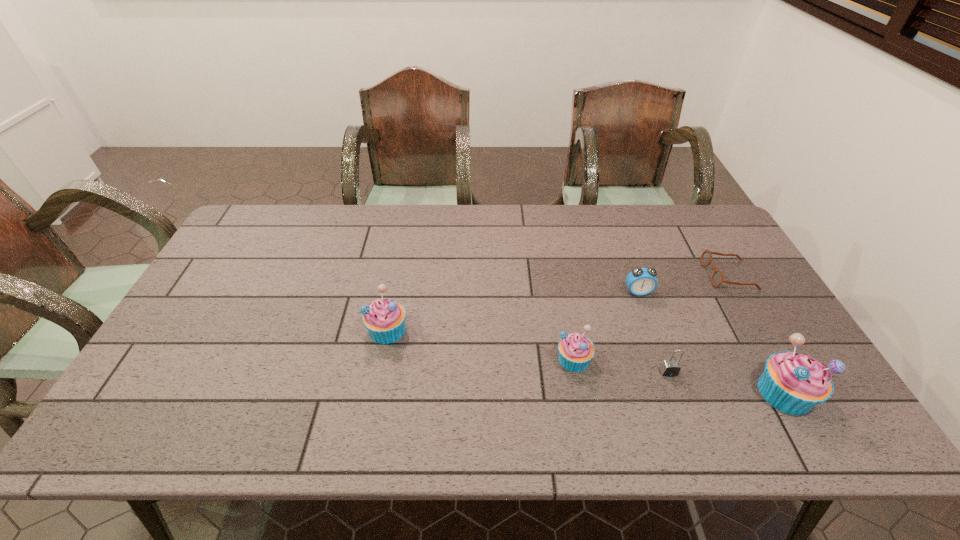
Image resolution: width=960 pixels, height=540 pixels. In order to click on vacant space located 0.080m on the back of the second muffin from right to left in this screenshot , I will do `click(566, 321)`.

Locate an element on the screen. The width and height of the screenshot is (960, 540). free space located on the back of the tallest object is located at coordinates (711, 262).

Locate an element on the screen. This screenshot has width=960, height=540. free spot located on the face of the alarm clock is located at coordinates (669, 379).

At what (x,y) coordinates should I click in order to perform the action: click on vacant space situated on the front-facing side of the spectacles. Please return your answer as a coordinate pair (x, y). This screenshot has width=960, height=540. Looking at the image, I should click on (635, 274).

You are a GUI agent. You are given a task and a screenshot of the screen. Output one action in this format:
    pyautogui.click(x=<x>, y=<y>)
    Task: Click on the blank space located on the front-facing side of the spectacles
    Image resolution: width=960 pixels, height=540 pixels.
    Given the screenshot: What is the action you would take?
    pyautogui.click(x=637, y=274)

This screenshot has width=960, height=540. I want to click on vacant point located 0.110m on the front-facing side of the spectacles, so click(670, 274).

Locate an element on the screen. The image size is (960, 540). blank space located 0.060m on the shackle of the padlock is located at coordinates (678, 399).

In order to click on padlock positioned at the near edge in this screenshot , I will do `click(669, 368)`.

This screenshot has height=540, width=960. Find the location of `muffin positioned at the right edge`. muffin positioned at the right edge is located at coordinates (793, 383).

This screenshot has width=960, height=540. In order to click on spectacles that is positioned at the right edge in this screenshot , I will do `click(717, 277)`.